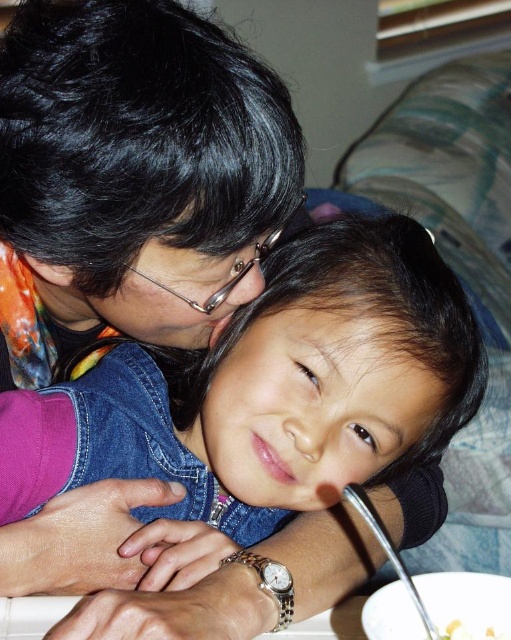
Question: Among these points, which one is nearest to the camera?

Choices:
 (A) (290, 212)
 (B) (429, 620)

Answer: (B)

Question: Can you confirm if metallic frame glasses at upper center is positioned to the right of yellow matte food at lower right?

Choices:
 (A) no
 (B) yes

Answer: (A)

Question: Estimate the real-world distances between objects in this image. Which object is closer to the metallic frame glasses at upper center?

Choices:
 (A) denim at center
 (B) yellow matte food at lower right

Answer: (A)

Question: Does denim at center appear on the left side of metallic frame glasses at upper center?

Choices:
 (A) no
 (B) yes

Answer: (B)

Question: Which of the following is the closest to the observer?

Choices:
 (A) metallic frame glasses at upper center
 (B) denim at center
 (C) yellow matte food at lower right

Answer: (C)

Question: Observing the image, what is the correct spatial positioning of denim at center in reference to yellow matte food at lower right?

Choices:
 (A) above
 (B) below

Answer: (A)